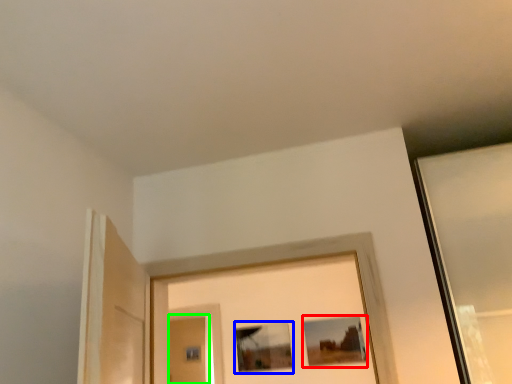
Question: Based on their relative distances, which object is farther from picture frame (highlighted by a red box)? Choose from picture frame (highlighted by a blue box) and screen door (highlighted by a green box).

Choices:
 (A) picture frame
 (B) screen door

Answer: (B)